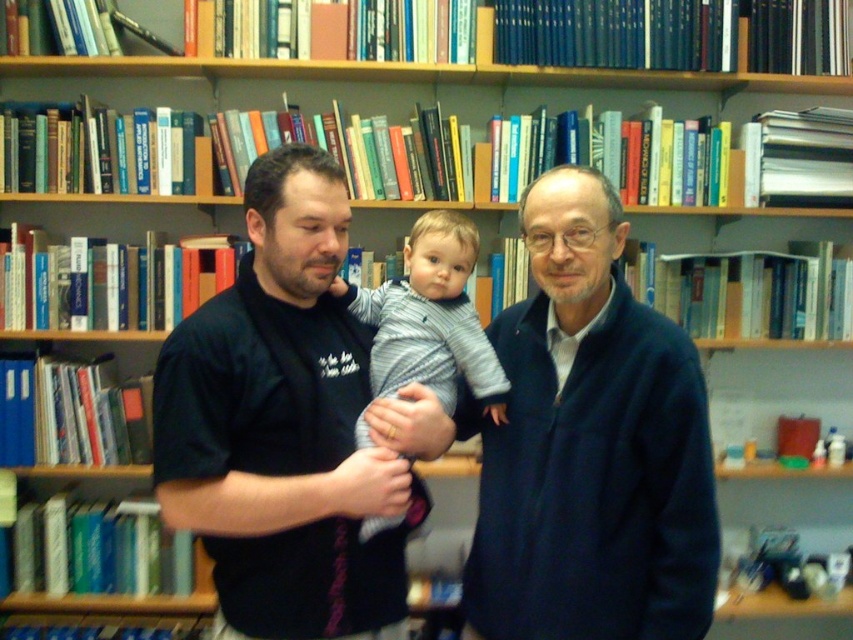
Is point (532, 552) closer to camera compared to point (410, 284)?

Yes, it is.

Is navy blue sweater at center behind striped knit sweater at center?

No, it is in front of striped knit sweater at center.

The width and height of the screenshot is (853, 640). What do you see at coordinates (590, 445) in the screenshot?
I see `navy blue sweater at center` at bounding box center [590, 445].

Where is `navy blue sweater at center`? The height and width of the screenshot is (640, 853). navy blue sweater at center is located at coordinates (590, 445).

Is black t-shirt at center shorter than striped knit sweater at center?

In fact, black t-shirt at center may be taller than striped knit sweater at center.

Which is in front, point (331, 380) or point (440, 374)?

Point (331, 380) is more forward.

Between point (305, 630) and point (387, 301), which one is positioned in front?

Point (305, 630) is more forward.

In order to click on black t-shirt at center in this screenshot , I will do `click(283, 426)`.

Does navy blue sweater at center appear on the left side of black t-shirt at center?

Incorrect, navy blue sweater at center is not on the left side of black t-shirt at center.

How far apart are navy blue sweater at center and black t-shirt at center?

The distance of navy blue sweater at center from black t-shirt at center is 12.00 inches.

Which is in front, point (701, 544) or point (234, 428)?

Positioned in front is point (701, 544).

Find the location of a particular element. This screenshot has width=853, height=640. navy blue sweater at center is located at coordinates (590, 445).